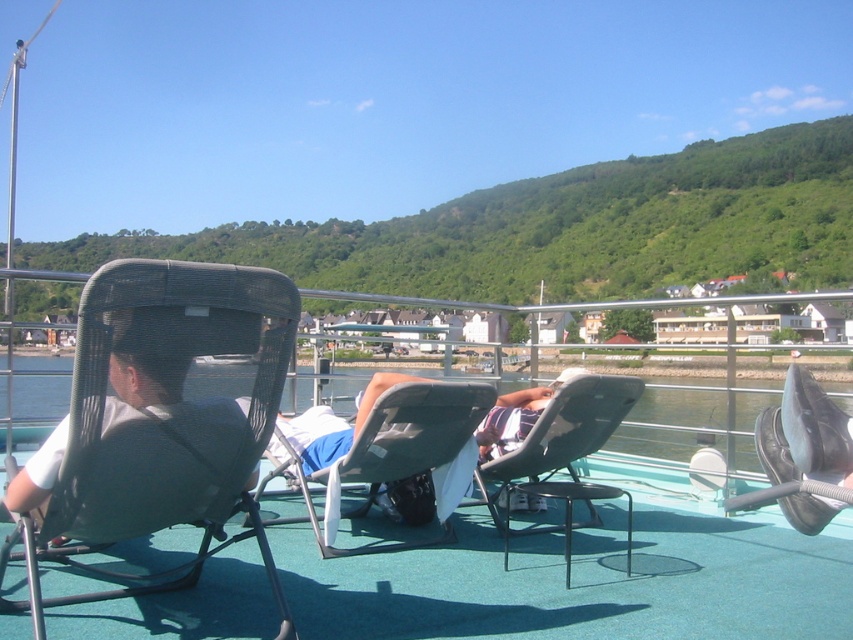
You are standing on the deck and want to place a 10 feet long ladder from the camera position to the matte black chair at center. Is the ladder long enough to reach the chair?

The distance of matte black chair at center from camera is 9.02 feet, so the 10 feet long ladder is long enough to reach the chair.